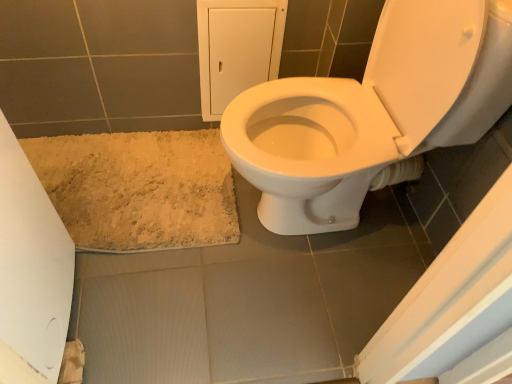
Find the location of a particular element. The image size is (512, 384). vacant point above beige shaggy bath mat at lower left (from a real-world perspective) is located at coordinates (122, 175).